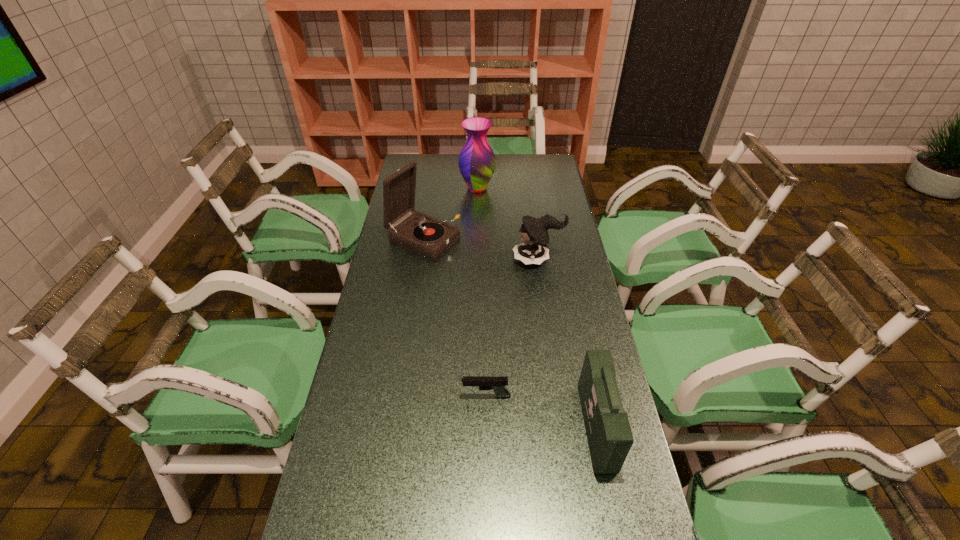
This screenshot has width=960, height=540. I want to click on the farthest object, so click(477, 162).

Find the location of a particular element. The height and width of the screenshot is (540, 960). phonograph record is located at coordinates [x=424, y=235].

Locate an element on the screen. The height and width of the screenshot is (540, 960). doll is located at coordinates (534, 250).

Identify the location of the first-aid kit. This screenshot has width=960, height=540. (609, 435).

The width and height of the screenshot is (960, 540). I want to click on pistol, so click(497, 384).

The width and height of the screenshot is (960, 540). I want to click on free space located on the back of the farthest object, so click(x=477, y=156).

In order to click on vacant space located 0.190m on the right of the phonograph record in this screenshot , I will do `click(510, 240)`.

The width and height of the screenshot is (960, 540). Find the location of `vacant region located at the face of the doll`. vacant region located at the face of the doll is located at coordinates (452, 259).

What are the coordinates of `vacant region located at the face of the doll` in the screenshot? It's located at (439, 259).

Where is `blank space located at the face of the doll`? The image size is (960, 540). blank space located at the face of the doll is located at coordinates pos(467,259).